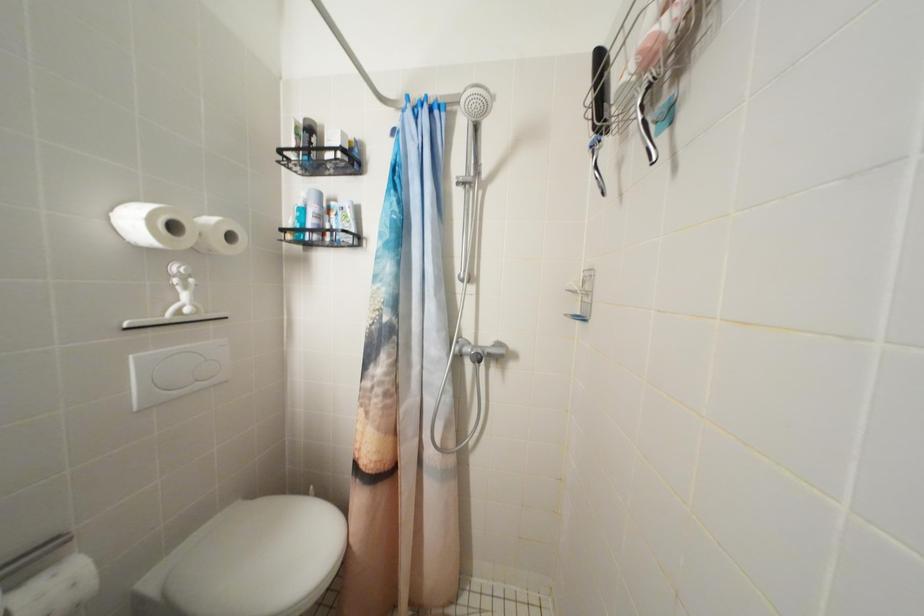
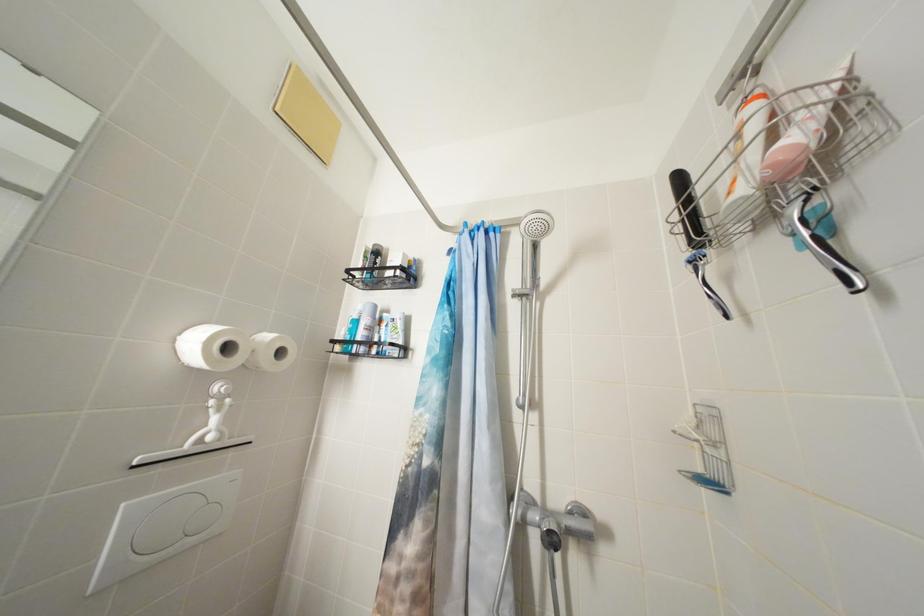
Question: The first image is from the beginning of the video and the second image is from the end. How did the camera likely rotate when shooting the video?

Choices:
 (A) Left
 (B) Right
 (C) Up
 (D) Down

Answer: (C)